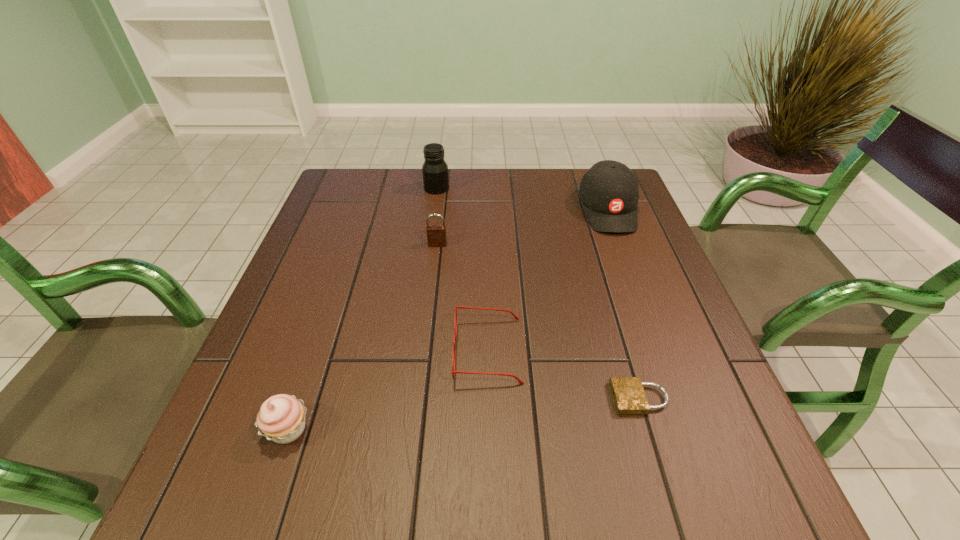
In order to click on free space at the near left corner in this screenshot , I will do `click(266, 497)`.

Locate an element on the screen. Image resolution: width=960 pixels, height=540 pixels. vacant space at the near right corner of the desktop is located at coordinates (690, 496).

Locate an element on the screen. vacant area that lies between the farther padlock and the baseball cap is located at coordinates (522, 227).

Locate an element on the screen. Image resolution: width=960 pixels, height=540 pixels. free space that is in between the jar and the right padlock is located at coordinates (538, 293).

In order to click on unoccupied area between the jar and the nearer padlock in this screenshot , I will do `click(538, 293)`.

At what (x,y) coordinates should I click in order to perform the action: click on vacant point located between the baseball cap and the right padlock. Please return your answer as a coordinate pair (x, y). Looking at the image, I should click on (623, 304).

You are a GUI agent. You are given a task and a screenshot of the screen. Output one action in this format:
    pyautogui.click(x=<x>, y=<y>)
    Task: Click on the vacant area that lies between the baseball cap and the spectacles
    Image resolution: width=960 pixels, height=540 pixels.
    Given the screenshot: What is the action you would take?
    pyautogui.click(x=548, y=280)

This screenshot has height=540, width=960. I want to click on free space between the jar and the cupcake, so click(363, 309).

You are a GUI agent. You are given a task and a screenshot of the screen. Output one action in this format:
    pyautogui.click(x=<x>, y=<y>)
    Task: Click on the free spot between the baseball cap and the spectacles
    
    Given the screenshot: What is the action you would take?
    pyautogui.click(x=548, y=280)

Locate an element on the screen. The image size is (960, 540). free space between the third farthest object and the baseball cap is located at coordinates (522, 227).